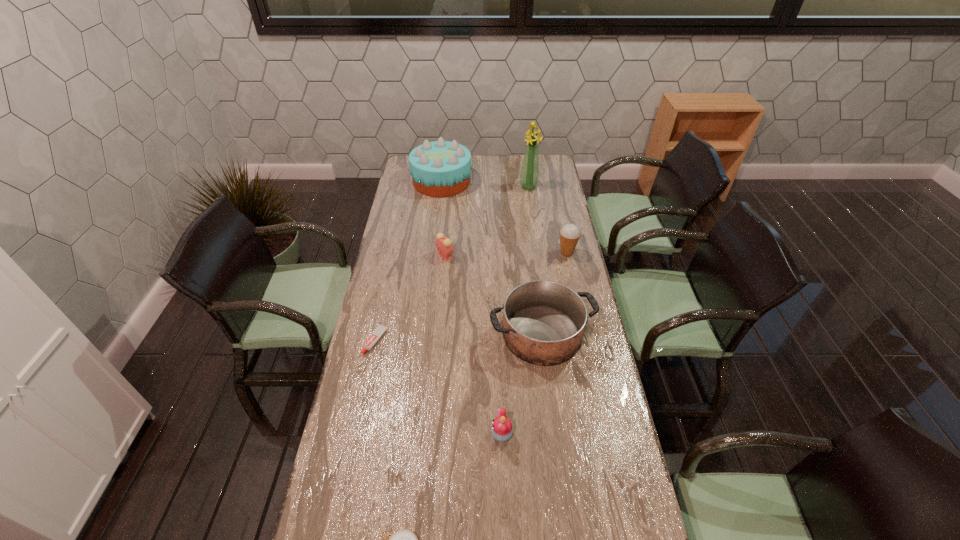
Where is `free point located on the left of the saucepan`? free point located on the left of the saucepan is located at coordinates (423, 334).

The image size is (960, 540). I want to click on vacant position located 0.150m on the face of the alarm clock, so click(489, 255).

At what (x,y) coordinates should I click in order to perform the action: click on vacant space located 0.360m on the face of the second nearest object. Please return your answer as a coordinate pair (x, y). This screenshot has width=960, height=540. Looking at the image, I should click on (372, 434).

Locate an element on the screen. The image size is (960, 540). free spot located 0.280m on the face of the second nearest object is located at coordinates (398, 434).

Where is `free spot located 0.140m on the face of the second nearest object`? The image size is (960, 540). free spot located 0.140m on the face of the second nearest object is located at coordinates (444, 434).

In order to click on free space located 0.060m on the back of the second shortest object in this screenshot , I will do `click(381, 314)`.

The width and height of the screenshot is (960, 540). Find the location of `object that is at the far edge`. object that is at the far edge is located at coordinates (441, 168).

Image resolution: width=960 pixels, height=540 pixels. I want to click on cake present at the left edge, so click(441, 168).

This screenshot has width=960, height=540. Identify the location of toothpaste located at the left edge. (380, 329).

Image resolution: width=960 pixels, height=540 pixels. I want to click on bouquet that is at the right edge, so click(529, 176).